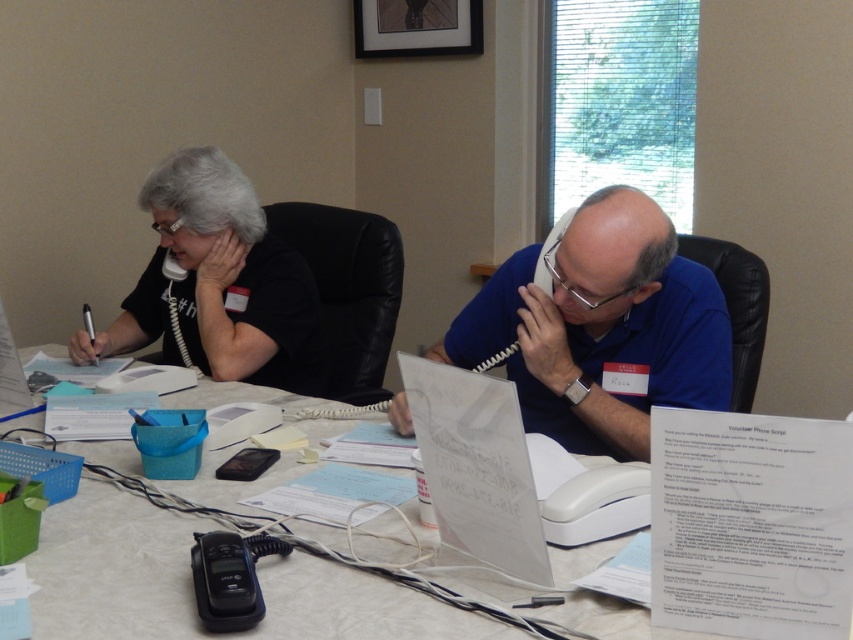
Question: Does blue fabric shirt at center have a lesser width compared to black matte shirt at upper left?

Choices:
 (A) no
 (B) yes

Answer: (A)

Question: Which object appears closest to the camera in this image?

Choices:
 (A) matte black phone at center
 (B) blue fabric shirt at center
 (C) white paper at center
 (D) black matte shirt at upper left

Answer: (C)

Question: Which is nearer to the black matte shirt at upper left?

Choices:
 (A) matte black phone at center
 (B) white paper at center

Answer: (A)

Question: Which object is positioned farthest from the white paper at center?

Choices:
 (A) blue fabric shirt at center
 (B) black matte shirt at upper left

Answer: (B)

Question: Considering the relative positions of white paper at center and blue fabric shirt at center in the image provided, where is white paper at center located with respect to blue fabric shirt at center?

Choices:
 (A) below
 (B) above

Answer: (A)

Question: Can you confirm if matte black phone at center is thinner than blue fabric shirt at center?

Choices:
 (A) yes
 (B) no

Answer: (A)